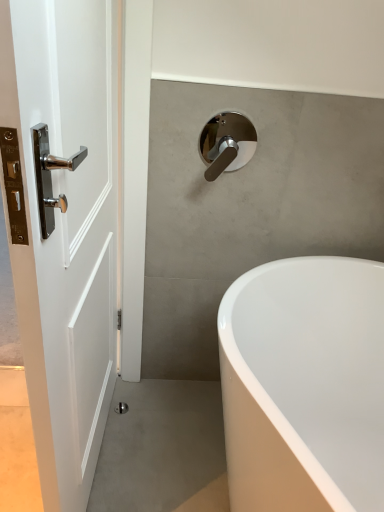
Locate an element on the screen. This screenshot has height=512, width=384. white glossy door at left is located at coordinates (65, 227).

Identify the location of chrome metallic tap at upper center. (226, 143).

Can you confirm if white glossy bathtub at lower right is positioned to the right of chrome metallic tap at upper center?

Yes.

From the image's perspective, is white glossy bathtub at lower right located above or below chrome metallic tap at upper center?

From the image's perspective, white glossy bathtub at lower right appears below chrome metallic tap at upper center.

Does white glossy bathtub at lower right come in front of chrome metallic tap at upper center?

Yes, white glossy bathtub at lower right is closer to the camera.

Which object is thinner, white glossy bathtub at lower right or chrome metallic tap at upper center?

chrome metallic tap at upper center.

Can you confirm if chrome metallic tap at upper center is taller than white glossy door at left?

No.

From the image's perspective, is chrome metallic tap at upper center on top of white glossy door at left?

Yes.

Which object is thinner, chrome metallic tap at upper center or white glossy door at left?

Thinner between the two is white glossy door at left.

Which object is further away from the camera, chrome metallic tap at upper center or white glossy door at left?

chrome metallic tap at upper center is more distant.

Is white glossy door at left smaller than chrome metallic tap at upper center?

No.

Can chrome metallic tap at upper center be found inside white glossy door at left?

Actually, chrome metallic tap at upper center is outside white glossy door at left.

Is chrome metallic tap at upper center at the back of white glossy door at left?

Yes, white glossy door at left's orientation is away from chrome metallic tap at upper center.

Does white glossy door at left appear on the left side of chrome metallic tap at upper center?

Indeed, white glossy door at left is positioned on the left side of chrome metallic tap at upper center.

Are white glossy door at left and white glossy bathtub at lower right located far from each other?

white glossy door at left is actually quite close to white glossy bathtub at lower right.

This screenshot has height=512, width=384. What are the coordinates of `bathtub below the white glossy door at left (from a real-world perspective)` in the screenshot? It's located at (304, 385).

Based on the photo, which object is positioned more to the right, white glossy door at left or white glossy bathtub at lower right?

white glossy bathtub at lower right is more to the right.

Does point (15, 5) lie in front of point (323, 321)?

Yes, point (15, 5) is in front of point (323, 321).

Who is smaller, white glossy bathtub at lower right or white glossy door at left?

white glossy door at left is smaller.

Is white glossy bathtub at lower right facing away from white glossy door at left?

No, white glossy bathtub at lower right's orientation is not away from white glossy door at left.

Locate an element on the screen. This screenshot has height=512, width=384. bathtub below the white glossy door at left (from a real-world perspective) is located at coordinates (304, 385).

Which of these two, white glossy bathtub at lower right or white glossy door at left, stands taller?

Standing taller between the two is white glossy door at left.

Would you say white glossy bathtub at lower right is part of chrome metallic tap at upper center's contents?

Actually, white glossy bathtub at lower right is outside chrome metallic tap at upper center.

From a real-world perspective, who is located lower, chrome metallic tap at upper center or white glossy bathtub at lower right?

white glossy bathtub at lower right, from a real-world perspective.

Who is bigger, chrome metallic tap at upper center or white glossy bathtub at lower right?

Bigger between the two is white glossy bathtub at lower right.

Are chrome metallic tap at upper center and white glossy bathtub at lower right far apart?

No, there isn't a large distance between chrome metallic tap at upper center and white glossy bathtub at lower right.

This screenshot has height=512, width=384. Identify the location of tap above the white glossy bathtub at lower right (from a real-world perspective). (226, 143).

Where is `door below the chrome metallic tap at upper center (from a real-world perspective)`? This screenshot has width=384, height=512. door below the chrome metallic tap at upper center (from a real-world perspective) is located at coordinates (65, 227).

Based on their spatial positions, is chrome metallic tap at upper center or white glossy door at left closer to white glossy bathtub at lower right?

white glossy door at left lies closer to white glossy bathtub at lower right than the other object.

From the image, which object appears to be nearer to white glossy door at left, white glossy bathtub at lower right or chrome metallic tap at upper center?

white glossy bathtub at lower right.

Based on their spatial positions, is white glossy bathtub at lower right or white glossy door at left further from chrome metallic tap at upper center?

The object further to chrome metallic tap at upper center is white glossy bathtub at lower right.

Based on their spatial positions, is chrome metallic tap at upper center or white glossy bathtub at lower right closer to white glossy door at left?

white glossy bathtub at lower right is closer to white glossy door at left.

When comparing their distances from chrome metallic tap at upper center, does white glossy door at left or white glossy bathtub at lower right seem closer?

Among the two, white glossy door at left is located nearer to chrome metallic tap at upper center.

From the image, which object appears to be farther from white glossy bathtub at lower right, white glossy door at left or chrome metallic tap at upper center?

chrome metallic tap at upper center lies further to white glossy bathtub at lower right than the other object.

Locate an element on the screen. This screenshot has width=384, height=512. door between chrome metallic tap at upper center and white glossy bathtub at lower right in the up-down direction is located at coordinates (65, 227).